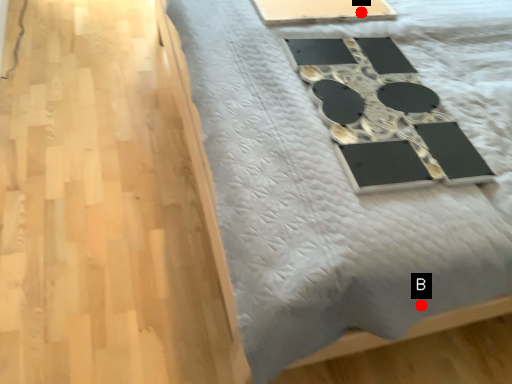
Question: Two points are circled on the image, labeled by A and B beside each circle. Which point appears farthest from the camera in this image?

Choices:
 (A) A is further
 (B) B is further

Answer: (A)